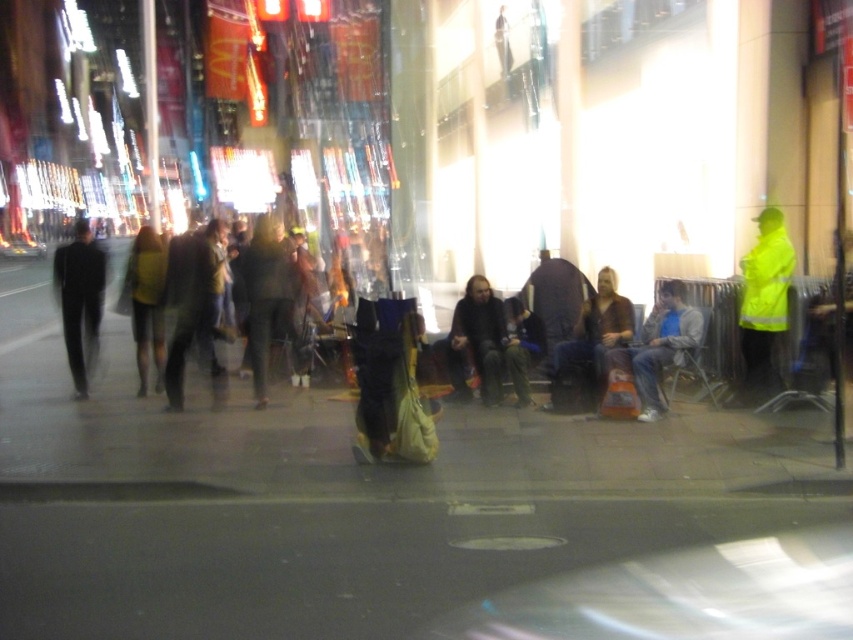
Question: Is brown leather jacket at center to the left of yellow matte dress at center from the viewer's perspective?

Choices:
 (A) yes
 (B) no

Answer: (B)

Question: Which of these objects is positioned closest to the blue denim jeans at lower right?

Choices:
 (A) dark gray pants at center
 (B) dark brown leather jacket at center
 (C) yellow matte dress at center

Answer: (B)

Question: Is smooth concrete pavement at center to the left of blue denim jeans at lower right from the viewer's perspective?

Choices:
 (A) no
 (B) yes

Answer: (B)

Question: Which object is closer to the camera taking this photo?

Choices:
 (A) dark brown leather jacket at center
 (B) blue denim jeans at lower right
 (C) dark gray pants at center

Answer: (B)

Question: Which point is farther to the camera?

Choices:
 (A) (566, 396)
 (B) (67, 305)
 (C) (289, 275)
 (D) (758, 230)

Answer: (B)

Question: Is smooth concrete pavement at center thinner than yellow matte dress at center?

Choices:
 (A) yes
 (B) no

Answer: (B)